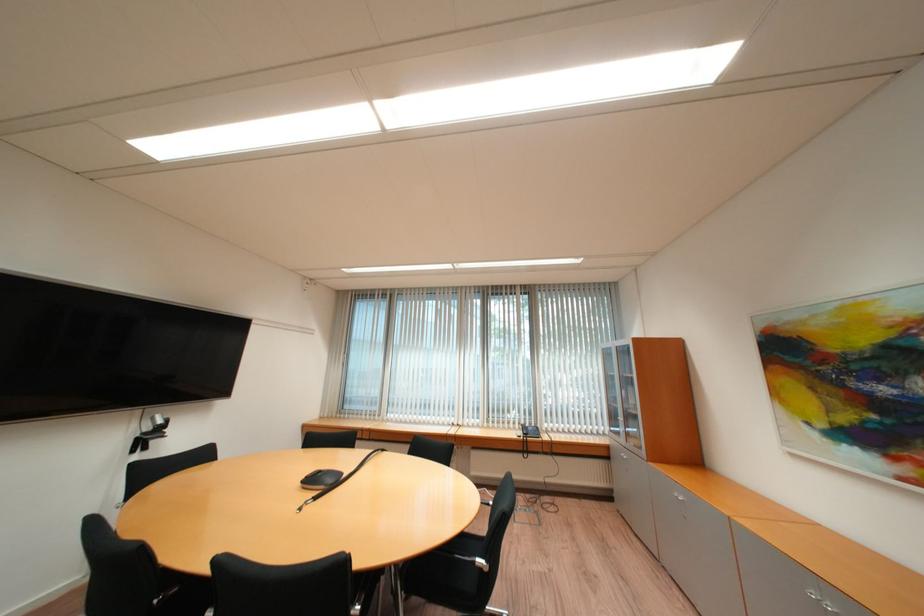
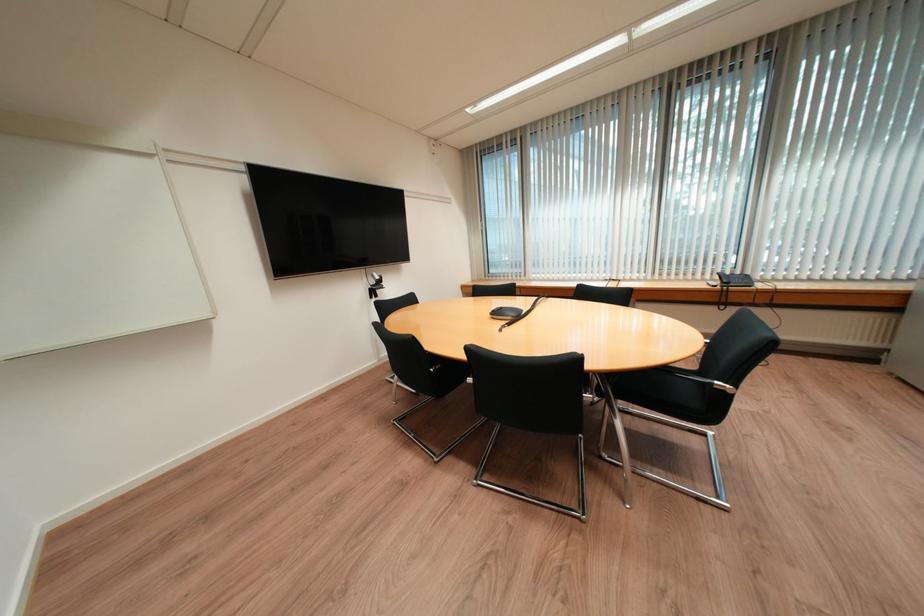
How did the camera likely rotate?

The camera rotated toward left-down.